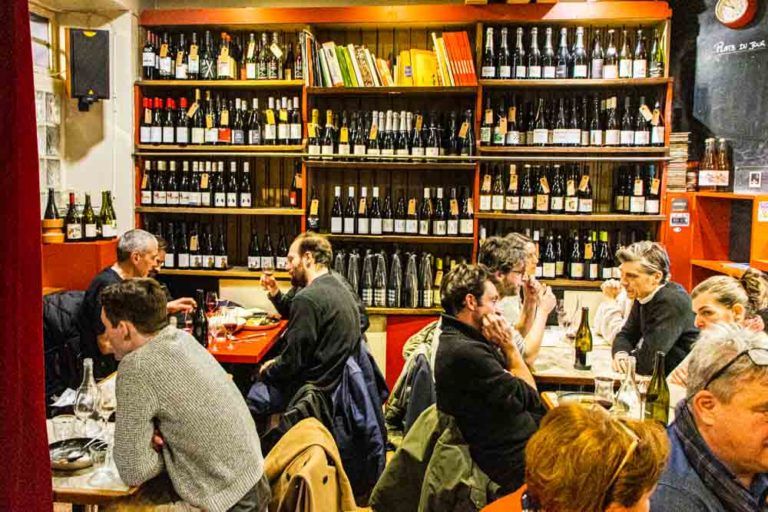
I want to click on wine glass, so click(224, 320), click(209, 306).